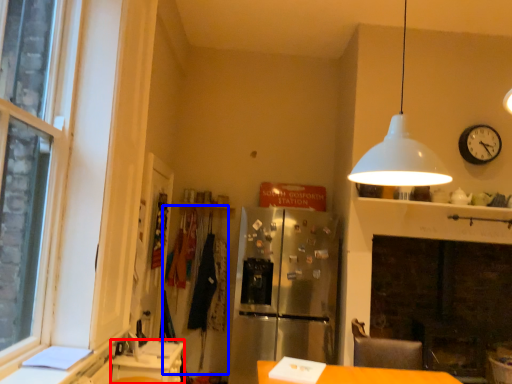
Question: Which point is further to the camera, counter (highlighted by a red box) or laundry (highlighted by a blue box)?

Choices:
 (A) counter
 (B) laundry

Answer: (B)